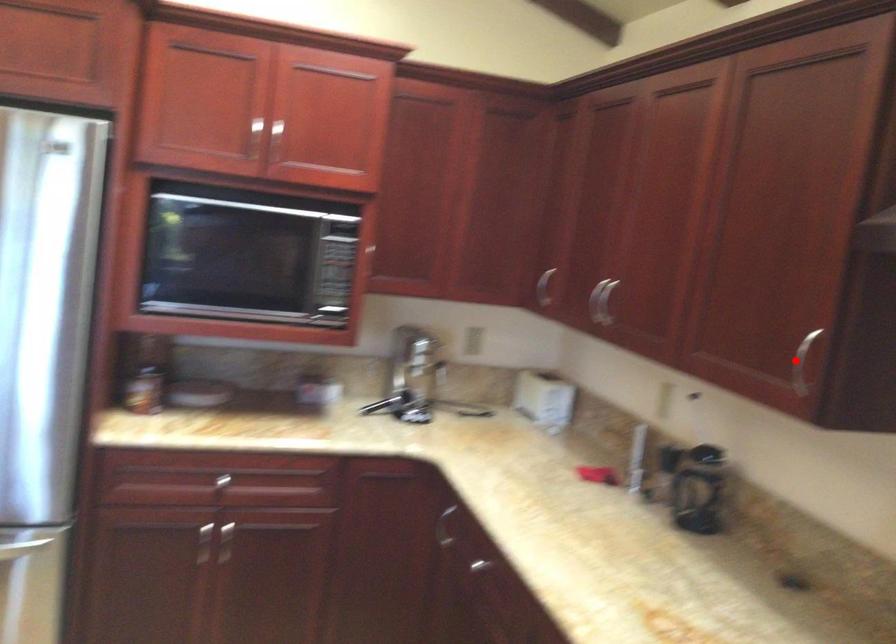
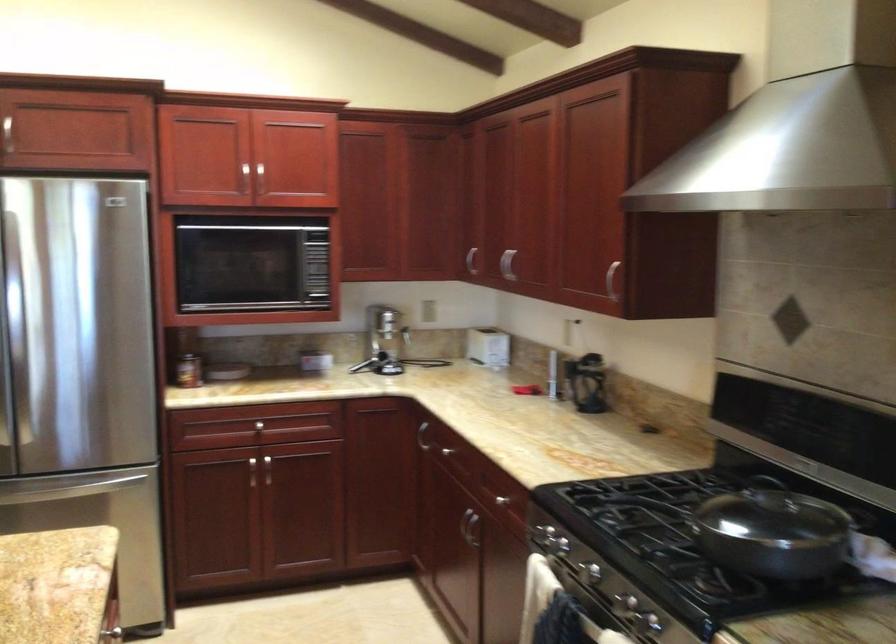
Question: I am providing you with two images of the same scene from different viewpoints. In image1, a red point is highlighted. Considering the same 3D point in image2, which of the following is correct?

Choices:
 (A) It is closer
 (B) It is farther

Answer: (B)